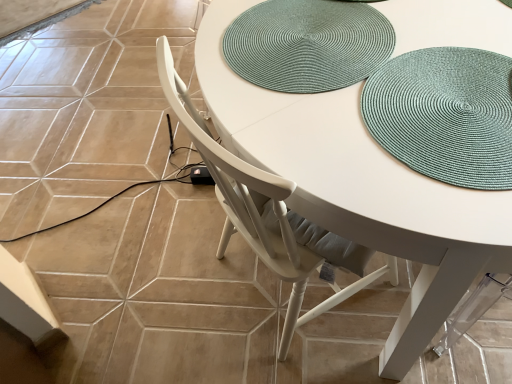
What do you see at coordinates (445, 115) in the screenshot? I see `teal woven placemat at upper right` at bounding box center [445, 115].

Where is `white wood chair at center`? The width and height of the screenshot is (512, 384). white wood chair at center is located at coordinates (267, 214).

Locate an element on the screen. The width and height of the screenshot is (512, 384). teal woven placemat at upper right is located at coordinates (445, 115).

Consider the image. Considering the positions of objects teal woven placemat at upper right and teal woven placemat at upper center in the image provided, who is more to the right, teal woven placemat at upper right or teal woven placemat at upper center?

Positioned to the right is teal woven placemat at upper right.

Between point (458, 109) and point (238, 72), which one is positioned behind?

The point (238, 72) is behind.

Is teal woven placemat at upper right oriented towards teal woven placemat at upper center?

No, teal woven placemat at upper right is not facing towards teal woven placemat at upper center.

Measure the distance between teal woven placemat at upper right and teal woven placemat at upper center.

They are 19.58 centimeters apart.

Which object is closer to the camera taking this photo, teal woven placemat at upper center or teal woven placemat at upper right?

teal woven placemat at upper right is more forward.

Is teal woven placemat at upper center taller or shorter than teal woven placemat at upper right?

Clearly, teal woven placemat at upper center is shorter compared to teal woven placemat at upper right.

Which point is more forward, (255,18) or (506,184)?

The point (506,184) is closer to the camera.

Is teal woven placemat at upper center looking in the opposite direction of teal woven placemat at upper right?

teal woven placemat at upper center does not have its back to teal woven placemat at upper right.

Would you consider teal woven placemat at upper center to be distant from white wood chair at center?

teal woven placemat at upper center is near white wood chair at center, not far away.

Is teal woven placemat at upper center bigger or smaller than white wood chair at center?

In the image, teal woven placemat at upper center appears to be smaller than white wood chair at center.

Is white wood chair at center inside teal woven placemat at upper center?

Actually, white wood chair at center is outside teal woven placemat at upper center.

Between point (233, 57) and point (301, 303), which one is positioned in front?

The point (233, 57) is closer.

Considering the relative positions of teal woven placemat at upper right and white wood chair at center in the image provided, is teal woven placemat at upper right to the left or to the right of white wood chair at center?

In the image, teal woven placemat at upper right appears on the left side of white wood chair at center.

Which of these two, teal woven placemat at upper right or white wood chair at center, stands taller?

white wood chair at center.

Which object is thinner, teal woven placemat at upper right or white wood chair at center?

teal woven placemat at upper right is thinner.

Where is `chair below the teal woven placemat at upper center (from the image's perspective)`? The width and height of the screenshot is (512, 384). chair below the teal woven placemat at upper center (from the image's perspective) is located at coordinates (267, 214).

Looking at their sizes, would you say white wood chair at center is wider or thinner than teal woven placemat at upper center?

Considering their sizes, white wood chair at center looks broader than teal woven placemat at upper center.

Between white wood chair at center and teal woven placemat at upper center, which one is positioned in front?

white wood chair at center.

Between white wood chair at center and teal woven placemat at upper right, which one has smaller size?

teal woven placemat at upper right is smaller.

From a real-world perspective, is white wood chair at center positioned under teal woven placemat at upper right based on gravity?

Yes, from a real-world perspective, white wood chair at center is under teal woven placemat at upper right.

Measure the distance between white wood chair at center and teal woven placemat at upper right.

A distance of 13.21 inches exists between white wood chair at center and teal woven placemat at upper right.

At what (x,y) coordinates should I click in order to perform the action: click on chair above the teal woven placemat at upper right (from the image's perspective). Please return your answer as a coordinate pair (x, y). The width and height of the screenshot is (512, 384). Looking at the image, I should click on (267, 214).

At what (x,y) coordinates should I click in order to perform the action: click on hat below the teal woven placemat at upper center (from the image's perspective). Please return your answer as a coordinate pair (x, y). Looking at the image, I should click on (445, 115).

Find the location of `mat below the teal woven placemat at upper right (from a real-world perspective)`. mat below the teal woven placemat at upper right (from a real-world perspective) is located at coordinates (307, 44).

Which object lies nearer to the anchor point teal woven placemat at upper center, teal woven placemat at upper right or white wood chair at center?

The object closer to teal woven placemat at upper center is teal woven placemat at upper right.

Estimate the real-world distances between objects in this image. Which object is further from white wood chair at center, teal woven placemat at upper center or teal woven placemat at upper right?

teal woven placemat at upper right is positioned further to the anchor white wood chair at center.

From the image, which object appears to be farther from teal woven placemat at upper center, white wood chair at center or teal woven placemat at upper right?

white wood chair at center.

Estimate the real-world distances between objects in this image. Which object is closer to white wood chair at center, teal woven placemat at upper right or teal woven placemat at upper center?

teal woven placemat at upper center lies closer to white wood chair at center than the other object.

Estimate the real-world distances between objects in this image. Which object is further from teal woven placemat at upper right, white wood chair at center or teal woven placemat at upper center?

Among the two, white wood chair at center is located further to teal woven placemat at upper right.

Estimate the real-world distances between objects in this image. Which object is closer to teal woven placemat at upper right, teal woven placemat at upper center or white wood chair at center?

The object closer to teal woven placemat at upper right is teal woven placemat at upper center.

At what (x,y) coordinates should I click in order to perform the action: click on hat between white wood chair at center and teal woven placemat at upper center in the front-back direction. Please return your answer as a coordinate pair (x, y). Looking at the image, I should click on (445, 115).